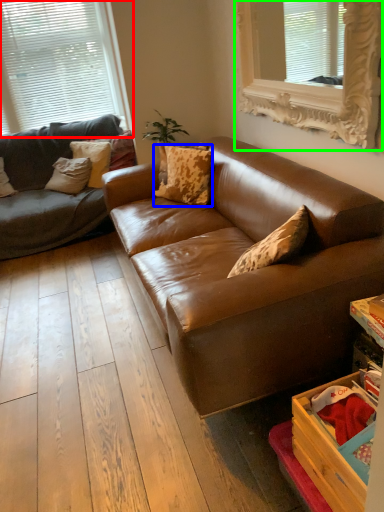
Question: Which is nearer to the window (highlighted by a red box)? pillow (highlighted by a blue box) or window (highlighted by a green box).

Choices:
 (A) pillow
 (B) window

Answer: (A)